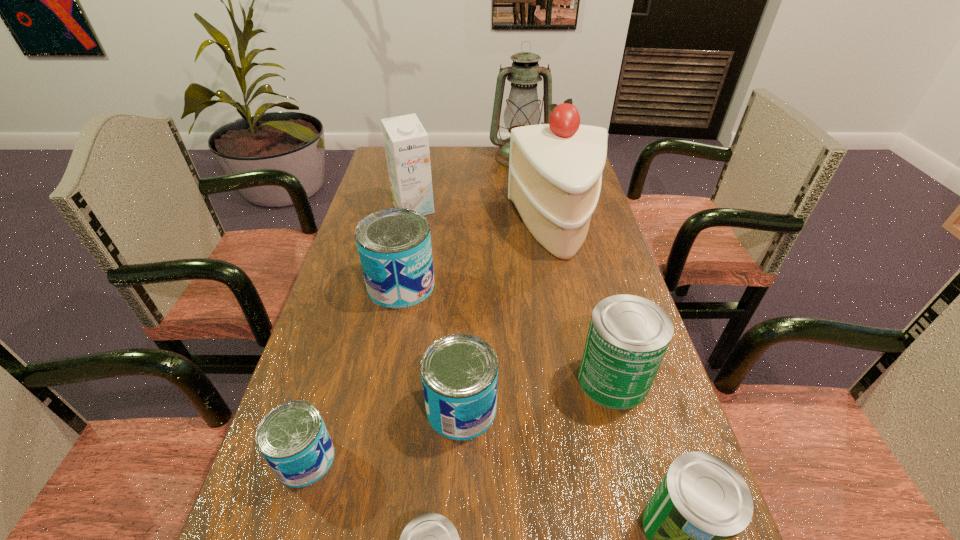
At what (x,y) coordinates should I click in order to perform the action: click on free spot located on the front of the eighth shortest object. Please return your answer as a coordinate pair (x, y). Looking at the image, I should click on (590, 373).

Locate an element on the screen. The height and width of the screenshot is (540, 960). vacant space situated 0.210m on the front of the seventh shortest object is located at coordinates (402, 266).

You are a GUI agent. You are given a task and a screenshot of the screen. Output one action in this format:
    pyautogui.click(x=<x>, y=<y>)
    Task: Click on the vacant space situated 0.180m on the back of the farthest blue can
    This screenshot has height=540, width=960.
    Given the screenshot: What is the action you would take?
    pyautogui.click(x=413, y=225)

Where is `free space located on the back of the farthest green can`? Image resolution: width=960 pixels, height=540 pixels. free space located on the back of the farthest green can is located at coordinates (578, 246).

Identify the location of free location located on the front of the rightmost blue can. (458, 504).

The image size is (960, 540). I want to click on vacant space located on the back of the smallest blue can, so click(x=356, y=292).

I want to click on object present at the far edge, so click(522, 109).

Where is `carton that is at the left edge`? carton that is at the left edge is located at coordinates click(x=406, y=142).

Locate an element on the screen. oil lamp situated at the right edge is located at coordinates (522, 109).

Identify the location of cake present at the right edge. (555, 170).